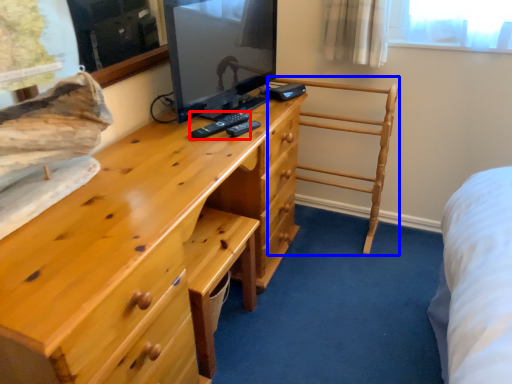
Question: Which point is further to the camera, remote (highlighted by a red box) or furniture (highlighted by a blue box)?

Choices:
 (A) remote
 (B) furniture

Answer: (B)